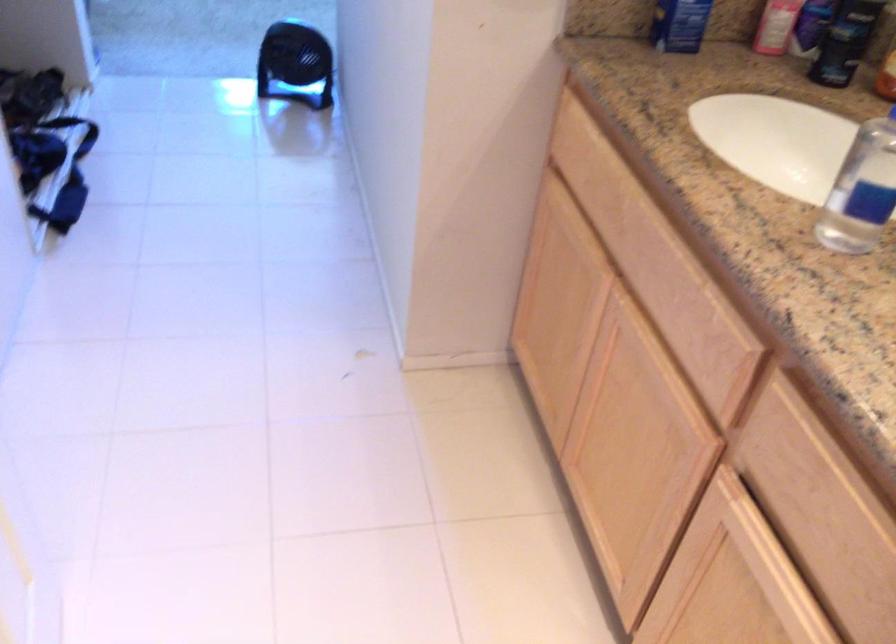
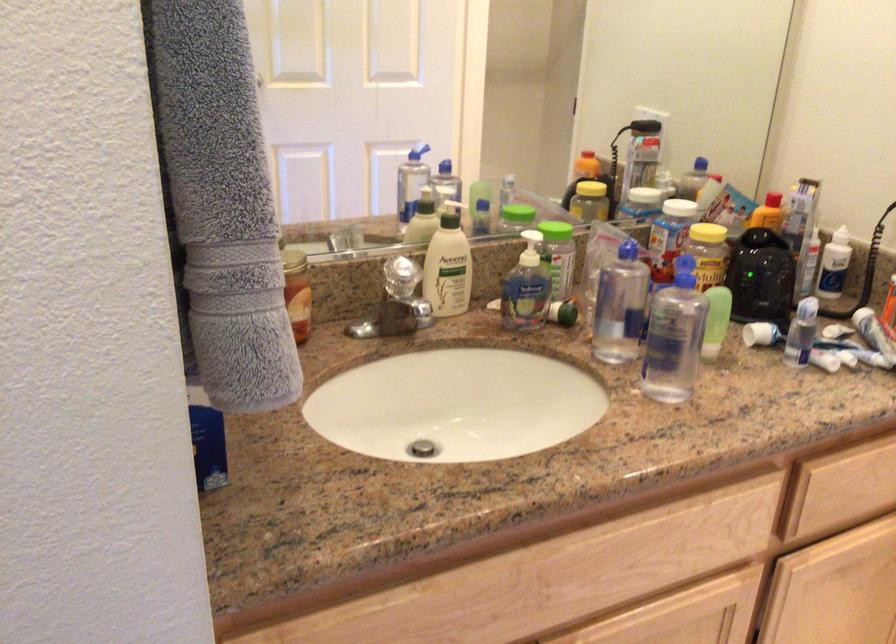
Question: I am providing you with two images of the same scene from different viewpoints. Which of the following objects are not visible in image2?

Choices:
 (A) black bottle
 (B) yellow jar lid
 (C) white product tube
 (D) orange cap bottle

Answer: (A)